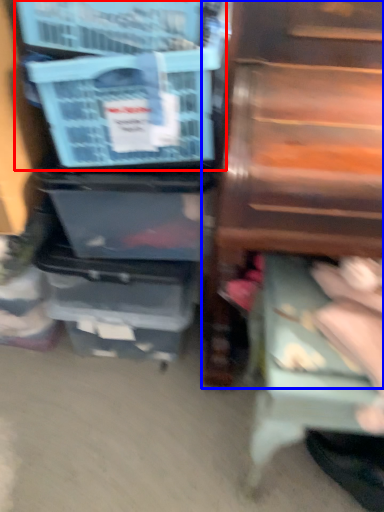
Question: Which point is closer to the camera, storage box (highlighted by a red box) or furniture (highlighted by a blue box)?

Choices:
 (A) storage box
 (B) furniture

Answer: (B)